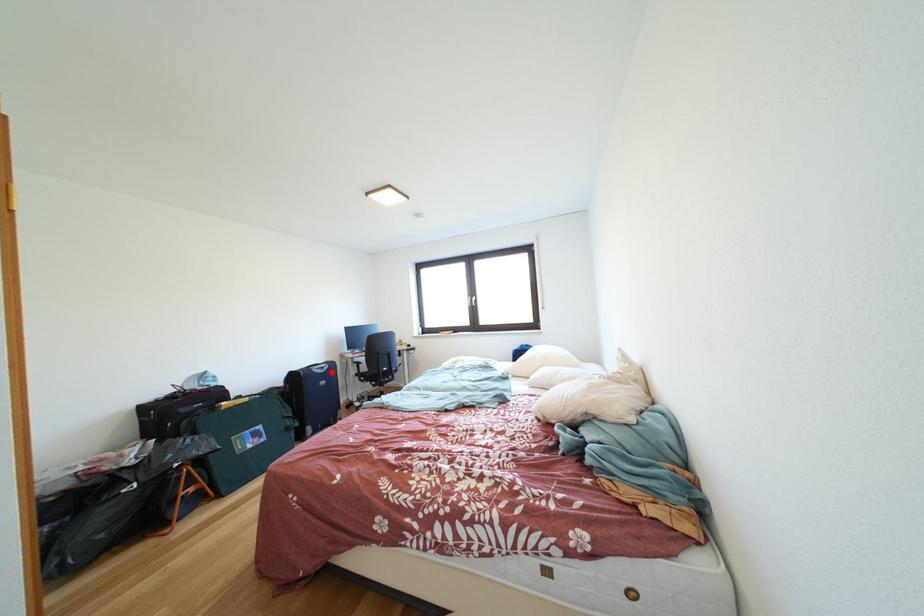
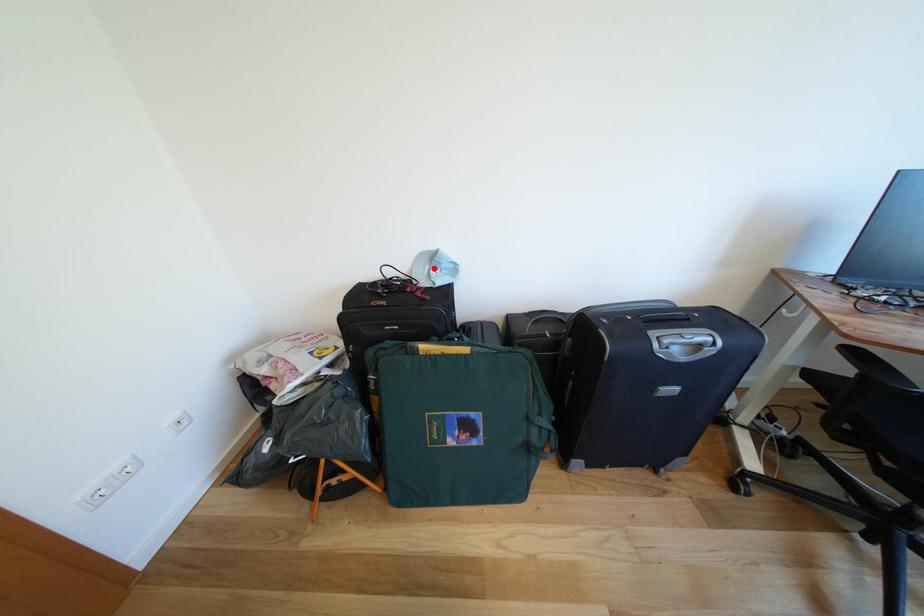
I am providing you with two images of the same scene from different viewpoints. A red point is marked on the first image and another point is marked on the second image. Do the highlighted points in image1 and image2 indicate the same real-world spot?

No